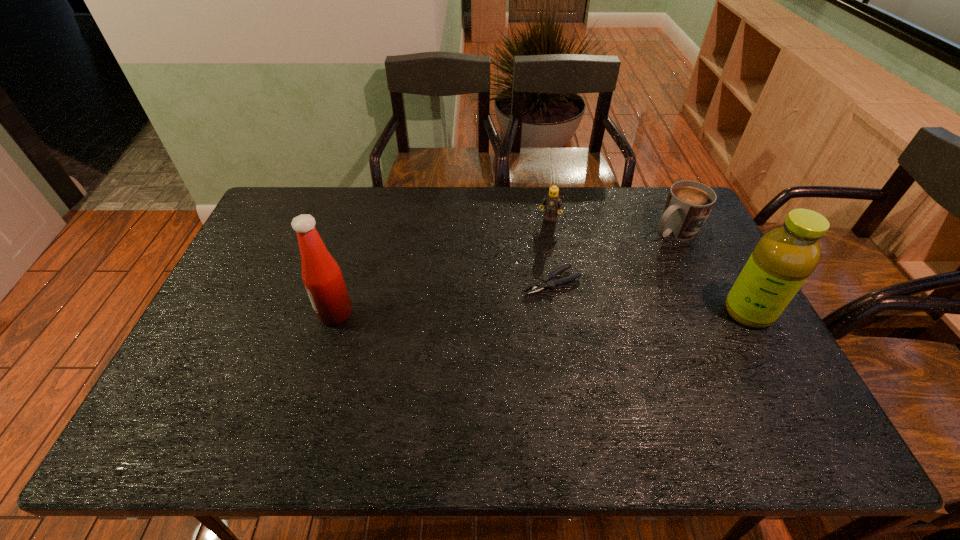
I want to click on mug located in the right edge section of the desktop, so click(689, 203).

What are the coordinates of `object present at the far right corner` in the screenshot? It's located at (689, 203).

In the image, there is a desktop. Identify the location of vacant space at the far edge. (343, 208).

Locate an element on the screen. blank space at the near edge of the desktop is located at coordinates (261, 379).

The height and width of the screenshot is (540, 960). In the image, there is a desktop. What are the coordinates of `vacant space at the left edge` in the screenshot? It's located at (275, 278).

In the image, there is a desktop. Where is `vacant space at the right edge`? The height and width of the screenshot is (540, 960). vacant space at the right edge is located at coordinates (714, 366).

The height and width of the screenshot is (540, 960). What are the coordinates of `blank space at the far left corner` in the screenshot? It's located at (273, 210).

You are a GUI agent. You are given a task and a screenshot of the screen. Output one action in this format:
    pyautogui.click(x=<x>, y=<y>)
    Task: Click on the free space between the fruit juice and the Lego
    Image resolution: width=960 pixels, height=540 pixels.
    Given the screenshot: What is the action you would take?
    pyautogui.click(x=649, y=266)

I want to click on free spot between the pliers and the Lego, so click(551, 251).

Where is `vacant area between the Lego and the mug`? vacant area between the Lego and the mug is located at coordinates (612, 225).